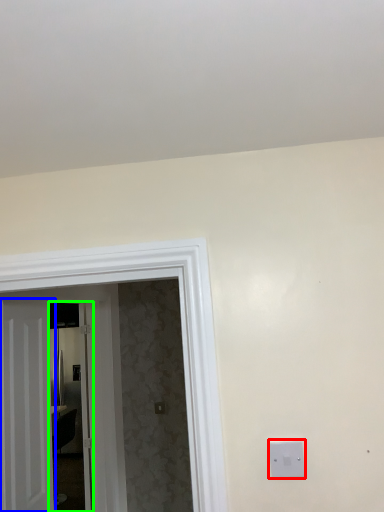
Question: Which object is the closest to the light switch (highlighted by a red box)? Choose among these: door (highlighted by a blue box) or glass door (highlighted by a green box).

Choices:
 (A) door
 (B) glass door

Answer: (A)